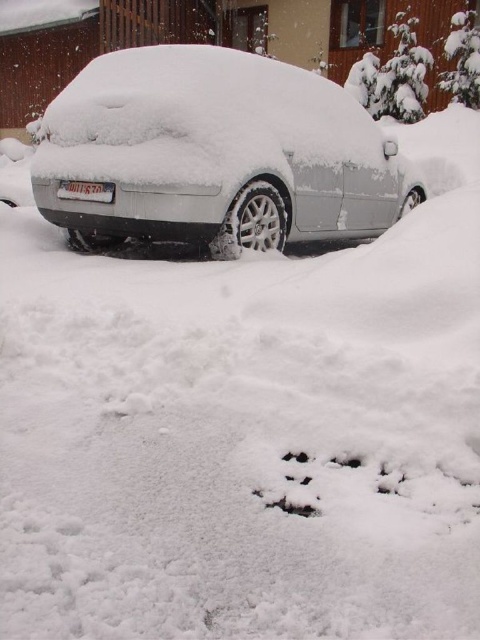
You are standing in the snow and want to check the license plate of the white matte car at center. If your maximum reach is 2 meters, can you touch the license plate without moving closer?

The white matte car at center is 3.99 meters away from the viewer, which is beyond the 2 meters reach. Therefore, you cannot touch the license plate without moving closer.

You are a delivery robot with a 1.2 meter arm. You need to pick up the white plastic license plate at center from the white matte car at center. Can your arm reach the license plate?

The white matte car at center and white plastic license plate at center are 1.07 meters apart from each other. Since the robot arm is 1.2 meters long, it can reach the license plate.